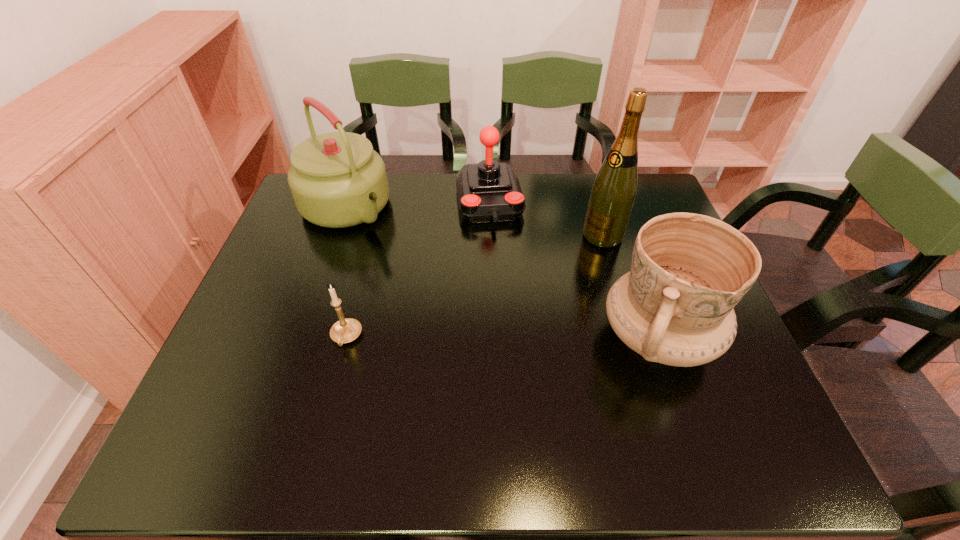
Locate an element on the screen. The width and height of the screenshot is (960, 540). vacant space located 0.150m on the base of the joystick is located at coordinates (500, 267).

At what (x,y) coordinates should I click in order to perform the action: click on free space located on the front-facing side of the wine bottle. Please return your answer as a coordinate pair (x, y). The height and width of the screenshot is (540, 960). Looking at the image, I should click on (579, 253).

In order to click on vacant space located 0.290m on the front-facing side of the wine bottle in this screenshot , I will do `click(517, 298)`.

The image size is (960, 540). I want to click on vacant position located 0.150m on the front-facing side of the wine bottle, so click(x=555, y=271).

The height and width of the screenshot is (540, 960). In order to click on free space located 0.270m at the spout of the kettle in this screenshot , I will do `click(424, 286)`.

Find the location of a particular element. The height and width of the screenshot is (540, 960). vacant space situated at the spout of the kettle is located at coordinates (456, 317).

Image resolution: width=960 pixels, height=540 pixels. What are the coordinates of `free space located at the spout of the kettle` in the screenshot? It's located at (404, 267).

In order to click on joystick at the far edge in this screenshot , I will do `click(489, 191)`.

Locate an element on the screen. kettle at the far edge is located at coordinates (337, 180).

The image size is (960, 540). In order to click on object present at the near edge in this screenshot , I will do `click(688, 271)`.